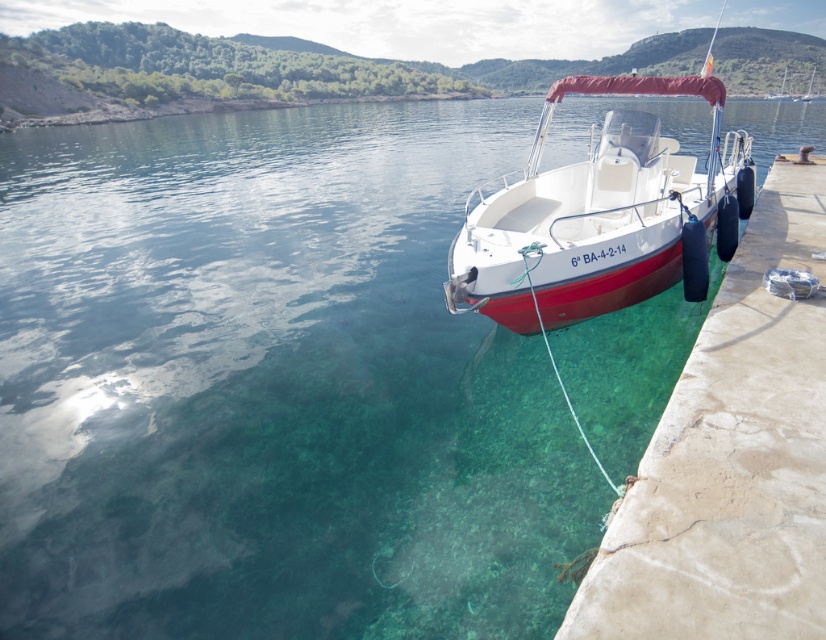
You are a photographer planning to capture the entire scene of the concrete at right and the white glossy boat at right in one shot. Based on their sizes in the image, which object would you need to frame more carefully to ensure it doesn

The concrete at right occupies less space than the white glossy boat at right, so you need to frame the concrete at right more carefully to ensure it is fully visible in the photo.

Based on the photo, you are a photographer planning to capture the white glossy boat at right and the concrete at right in a single shot. Based on their heights, which object should you position closer to the camera to ensure both are fully visible in the frame?

Since the concrete at right is shorter than the white glossy boat at right, you should position the concrete at right closer to the camera to ensure both objects are fully visible in the frame.

You are standing on the dock and see the concrete at right and the white glossy boat at right. Which one is positioned to the left?

The concrete at right is positioned to the left of the white glossy boat at right.